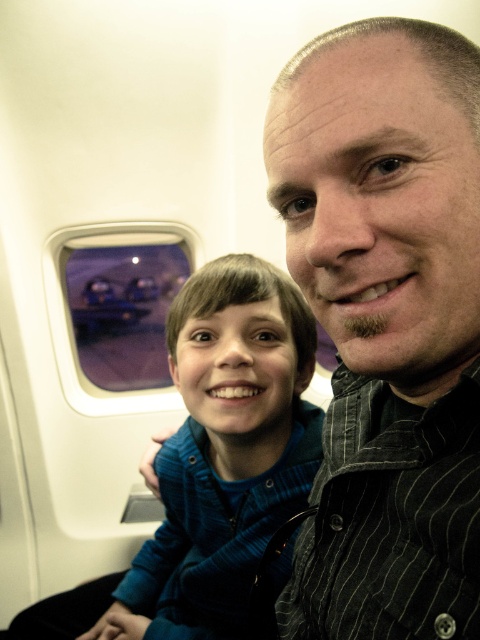
Question: Is black striped shirt at upper right smaller than blue striped shirt at center?

Choices:
 (A) no
 (B) yes

Answer: (B)

Question: Observing the image, what is the correct spatial positioning of blue striped shirt at center in reference to transparent glass airplane window at upper left?

Choices:
 (A) left
 (B) right

Answer: (B)

Question: Does blue striped shirt at center come in front of transparent glass airplane window at upper left?

Choices:
 (A) no
 (B) yes

Answer: (B)

Question: Among these objects, which one is farthest from the camera?

Choices:
 (A) blue striped shirt at center
 (B) black striped shirt at upper right
 (C) transparent glass airplane window at upper left

Answer: (C)

Question: Based on their relative distances, which object is nearer to the blue striped shirt at center?

Choices:
 (A) transparent glass airplane window at upper left
 (B) black striped shirt at upper right

Answer: (B)

Question: Which point is farther to the camera?

Choices:
 (A) (233, 620)
 (B) (132, 308)

Answer: (B)